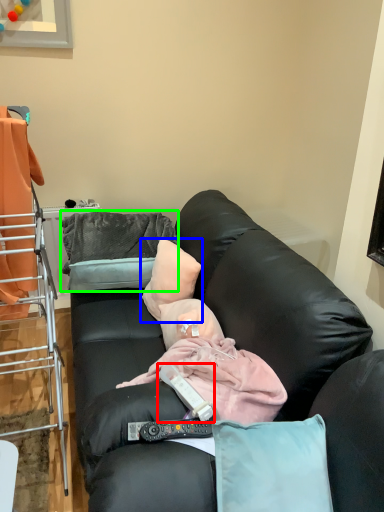
Question: Based on their relative distances, which object is nearer to remote control (highlighted by a red box)? Choose from pillow (highlighted by a blue box) and pillow (highlighted by a green box).

Choices:
 (A) pillow
 (B) pillow

Answer: (A)